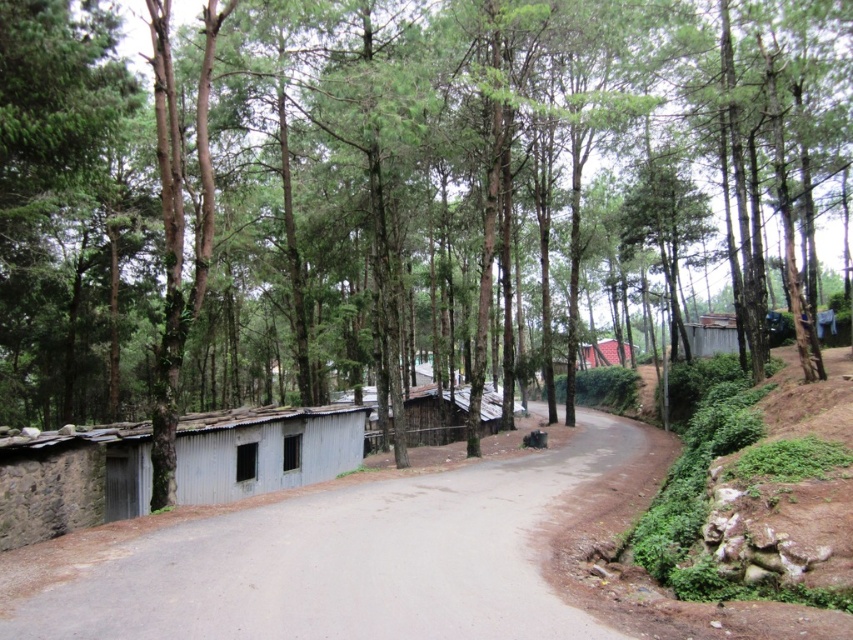
Question: Which point appears farthest from the camera in this image?

Choices:
 (A) [x=604, y=348]
 (B) [x=502, y=461]

Answer: (A)

Question: Which object is positioned farthest from the gray concrete road at center?

Choices:
 (A) metal corrugated hut at left
 (B) brown corrugated metal hut at center-right

Answer: (B)

Question: Does metal corrugated hut at left have a lesser width compared to brown corrugated metal hut at center-right?

Choices:
 (A) no
 (B) yes

Answer: (B)

Question: Considering the real-world distances, which object is closest to the metal corrugated hut at left?

Choices:
 (A) brown corrugated metal hut at center-right
 (B) gray concrete road at center

Answer: (B)

Question: Where is metal corrugated hut at left located in relation to brown corrugated metal hut at center-right in the image?

Choices:
 (A) left
 (B) right

Answer: (A)

Question: Observing the image, what is the correct spatial positioning of metal corrugated hut at left in reference to brown corrugated metal hut at center-right?

Choices:
 (A) right
 (B) left

Answer: (B)